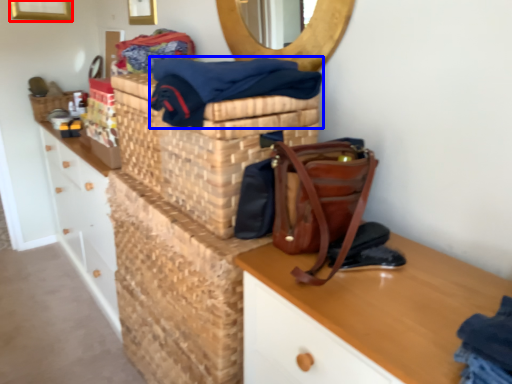
Question: Which point is closer to the camera, picture frame (highlighted by a red box) or clothing (highlighted by a blue box)?

Choices:
 (A) picture frame
 (B) clothing

Answer: (B)